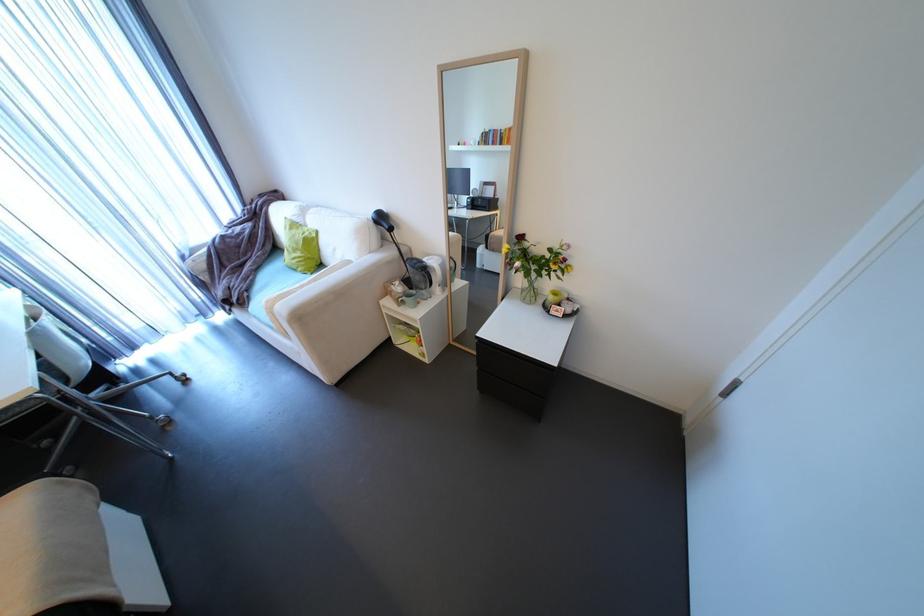
Locate an element on the screen. grey electric kettle is located at coordinates (419, 277).